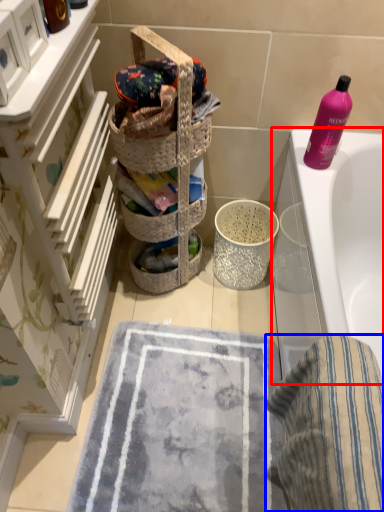
Question: Which of the following is the closest to the observer, bathtub (highlighted by a red box) or beach towel (highlighted by a blue box)?

Choices:
 (A) bathtub
 (B) beach towel

Answer: (B)